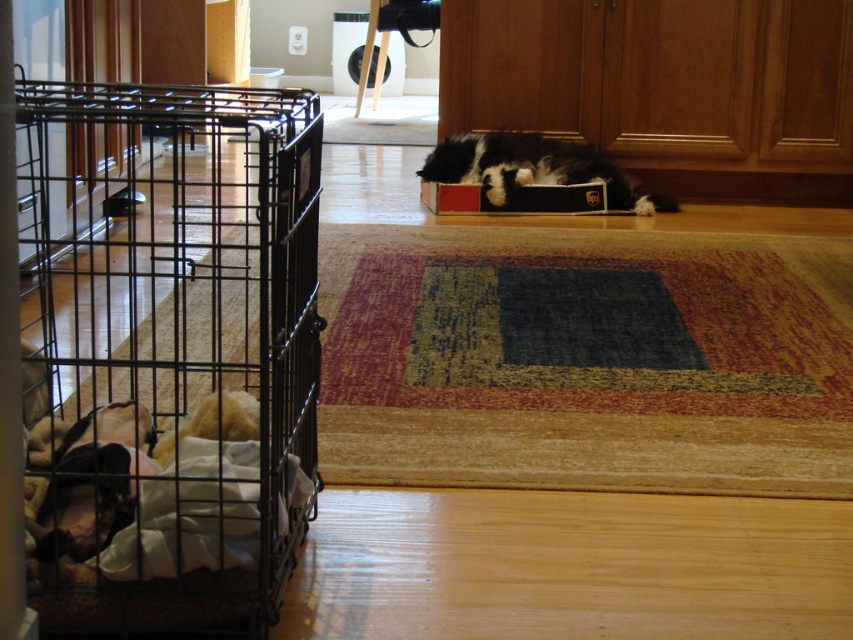
You are a small toy that can move freely in the room. You want to roll from the black wire cage at left to the black and white fur cat at center. Which direction should you move to get closer to the cat?

The black wire cage at left is closer to the viewer than the black and white fur cat at center. To move towards the cat, you should roll forward away from the viewer since the cat is further back in the scene.

You are a pet owner who wants to move the black wire cage at left closer to the black and white fur cat at center. Based on the scene, is there enough space between them to slide the cage over?

The black wire cage at left is positioned on the left side of the black and white fur cat at center, so there is space between them. You can slide the cage over towards the cat.

You are standing in the room and see the black and white fur cat at center and the red cardboard box at center. Which object is positioned to the right side?

The black and white fur cat at center is to the right of the red cardboard box at center.